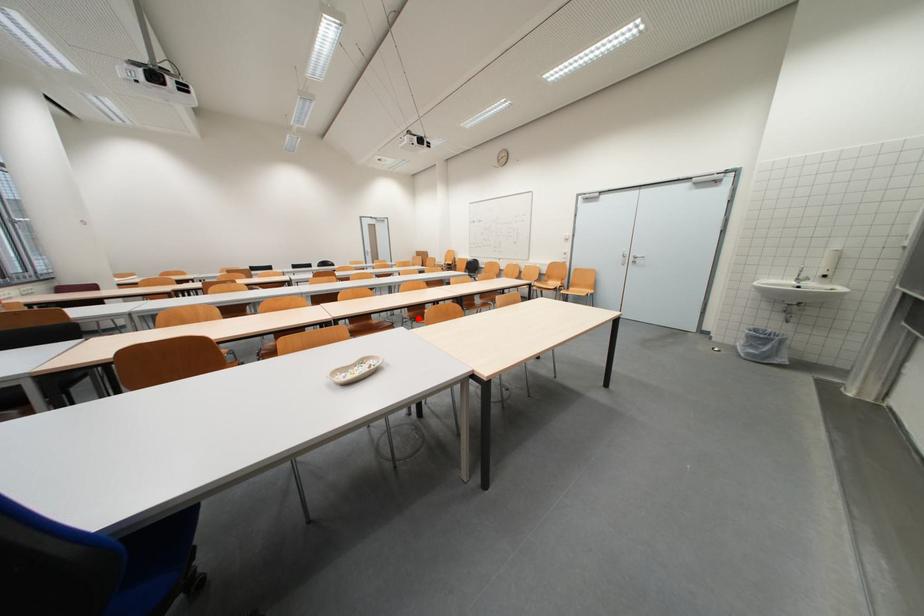
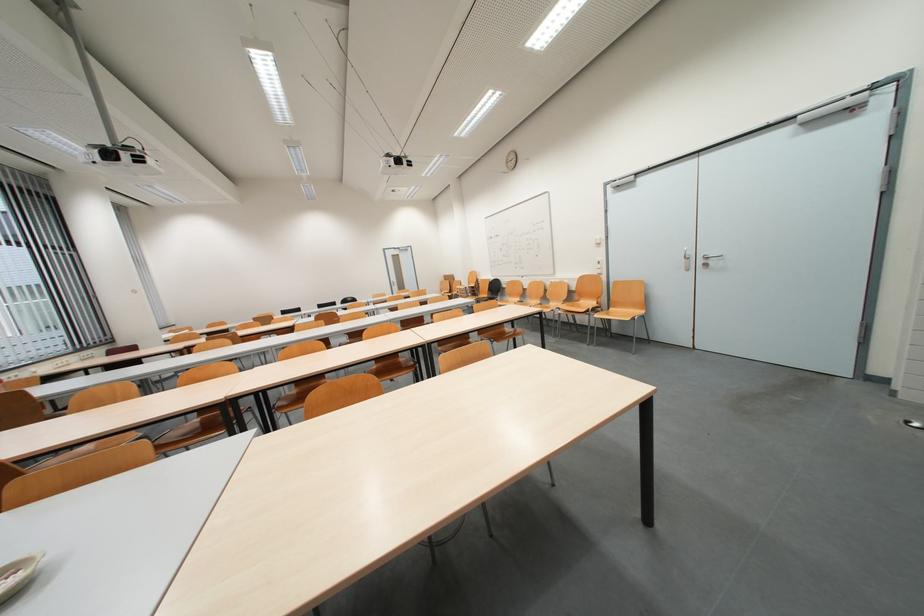
Locate, in the second image, the point that corresponds to the highlighted location in the first image.

(386, 370)